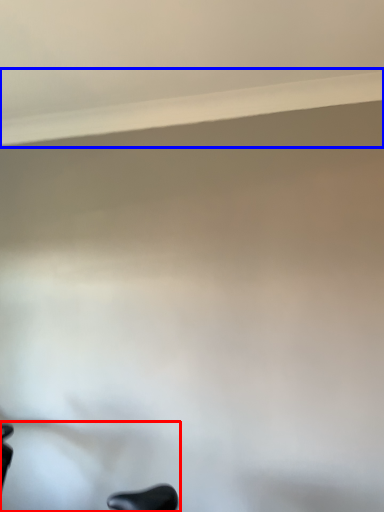
Question: Which object appears closest to the camera in this image, swivel chair (highlighted by a red box) or window sill (highlighted by a blue box)?

Choices:
 (A) swivel chair
 (B) window sill

Answer: (A)